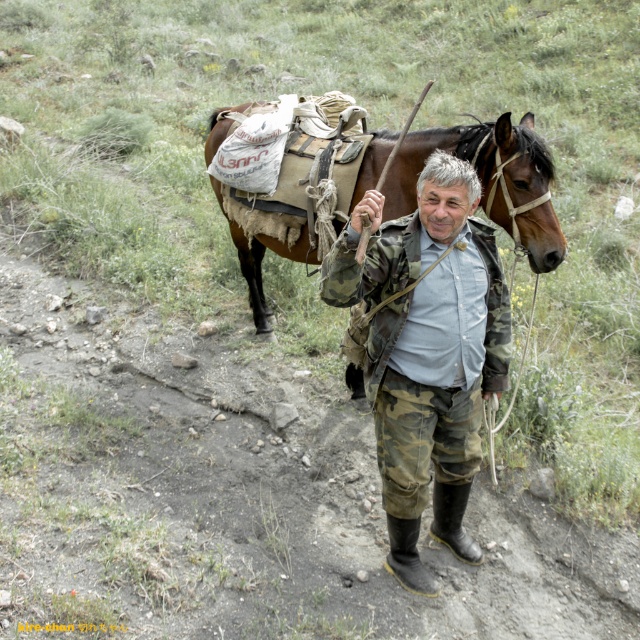
What do you see at coordinates (426, 353) in the screenshot? I see `camouflage fabric jacket at center` at bounding box center [426, 353].

Can you confirm if camouflage fabric jacket at center is positioned to the right of brown leather saddle at upper center?

Correct, you'll find camouflage fabric jacket at center to the right of brown leather saddle at upper center.

Who is more distant from viewer, (436, 444) or (305, 182)?

The point (305, 182) is more distant.

This screenshot has width=640, height=640. In order to click on camouflage fabric jacket at center in this screenshot , I will do `click(426, 353)`.

Between brown leather saddle at upper center and rubber/matte boot at lower center, which one is positioned higher?

brown leather saddle at upper center is higher up.

Who is more distant from viewer, (536, 154) or (413, 532)?

Positioned behind is point (536, 154).

Where is `brown leather saddle at upper center`? Image resolution: width=640 pixels, height=640 pixels. brown leather saddle at upper center is located at coordinates (488, 179).

What do you see at coordinates (452, 520) in the screenshot? I see `rubber/mesh boot at lower center` at bounding box center [452, 520].

At what (x,y) coordinates should I click in order to perform the action: click on rubber/mesh boot at lower center. Please return your answer as a coordinate pair (x, y). This screenshot has height=640, width=640. Looking at the image, I should click on (452, 520).

Image resolution: width=640 pixels, height=640 pixels. What are the coordinates of `rubber/mesh boot at lower center` in the screenshot? It's located at (452, 520).